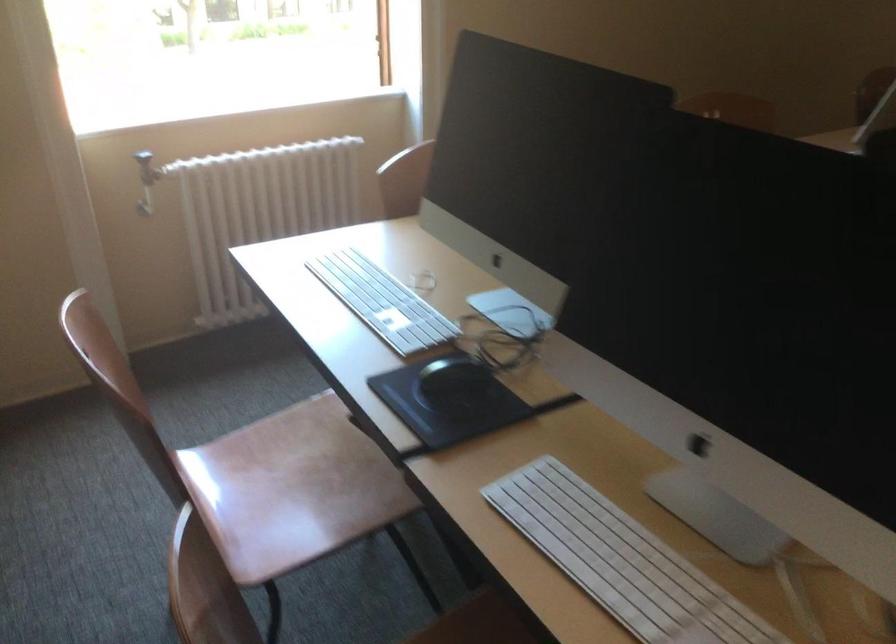
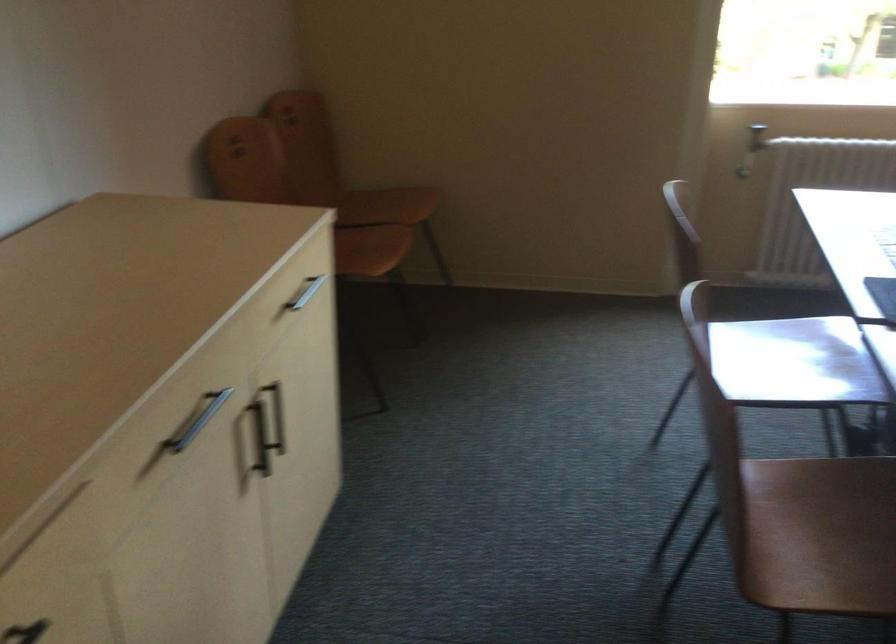
Locate, in the second image, the point that corresponds to (321,484) in the first image.

(794, 362)